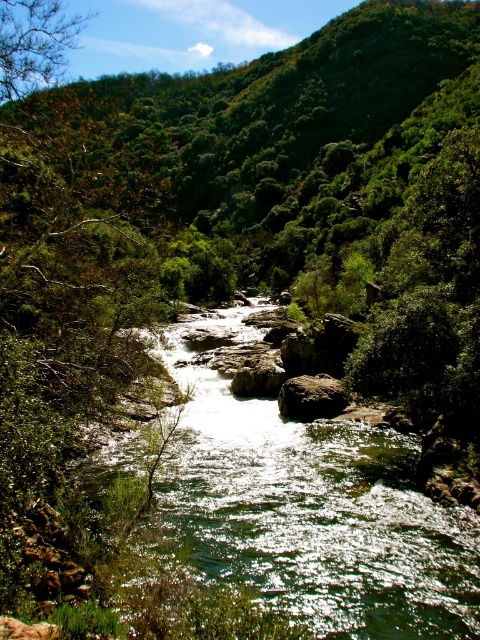
Question: From the image, what is the correct spatial relationship of green translucent water at center in relation to brown rough rock at center?

Choices:
 (A) right
 (B) left

Answer: (B)

Question: Which of the following is the farthest from the observer?

Choices:
 (A) green translucent water at center
 (B) brown rough rock at center

Answer: (B)

Question: Is green translucent water at center positioned at the back of brown rough rock at center?

Choices:
 (A) no
 (B) yes

Answer: (A)

Question: Is green translucent water at center closer to the viewer compared to brown rough rock at center?

Choices:
 (A) no
 (B) yes

Answer: (B)